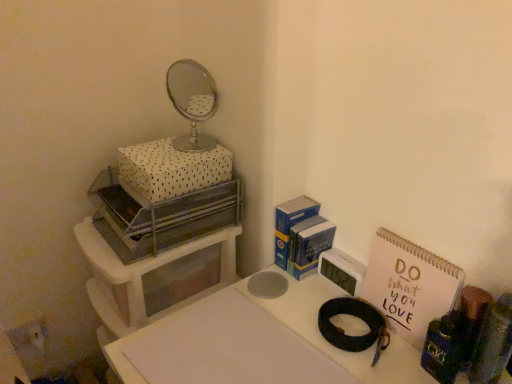
Question: Is pink paper notebook at right wider than white plastic storage unit at left?

Choices:
 (A) yes
 (B) no

Answer: (B)

Question: From the image's perspective, is pink paper notebook at right located beneath white plastic storage unit at left?

Choices:
 (A) no
 (B) yes

Answer: (A)

Question: Considering the relative sizes of pink paper notebook at right and white plastic storage unit at left in the image provided, is pink paper notebook at right thinner than white plastic storage unit at left?

Choices:
 (A) no
 (B) yes

Answer: (B)

Question: Is pink paper notebook at right at the right side of white plastic storage unit at left?

Choices:
 (A) yes
 (B) no

Answer: (A)

Question: From the image's perspective, is pink paper notebook at right on white plastic storage unit at left?

Choices:
 (A) yes
 (B) no

Answer: (A)

Question: Does pink paper notebook at right have a larger size compared to white plastic storage unit at left?

Choices:
 (A) no
 (B) yes

Answer: (A)

Question: Is white plastic clock at center-right, which is the 1th appliance from back to front, bigger than metallic silver tray at upper left, acting as the 3th appliance starting from the right?

Choices:
 (A) no
 (B) yes

Answer: (A)

Question: From a real-world perspective, is white plastic clock at center-right, which ranks as the second appliance in left-to-right order, located higher than metallic silver tray at upper left, the 1th appliance when ordered from left to right?

Choices:
 (A) yes
 (B) no

Answer: (B)

Question: Considering the relative positions of white plastic clock at center-right, which is the third appliance from front to back, and metallic silver tray at upper left, which is the 2th appliance in front-to-back order, in the image provided, is white plastic clock at center-right, which is the third appliance from front to back, behind metallic silver tray at upper left, which is the 2th appliance in front-to-back order,?

Choices:
 (A) no
 (B) yes

Answer: (B)

Question: Is white plastic clock at center-right, which is the 1th appliance from back to front, next to metallic silver tray at upper left, which is the 2th appliance in front-to-back order?

Choices:
 (A) no
 (B) yes

Answer: (A)

Question: Can you confirm if white plastic clock at center-right, which is the 1th appliance from back to front, is positioned to the right of metallic silver tray at upper left, acting as the 3th appliance starting from the right?

Choices:
 (A) yes
 (B) no

Answer: (A)

Question: Is white plastic clock at center-right, which is the third appliance from front to back, not within metallic silver tray at upper left, the 1th appliance when ordered from left to right?

Choices:
 (A) no
 (B) yes

Answer: (B)

Question: From the image's perspective, is white matte table at center under shiny metallic magnifying glass at upper center?

Choices:
 (A) yes
 (B) no

Answer: (A)